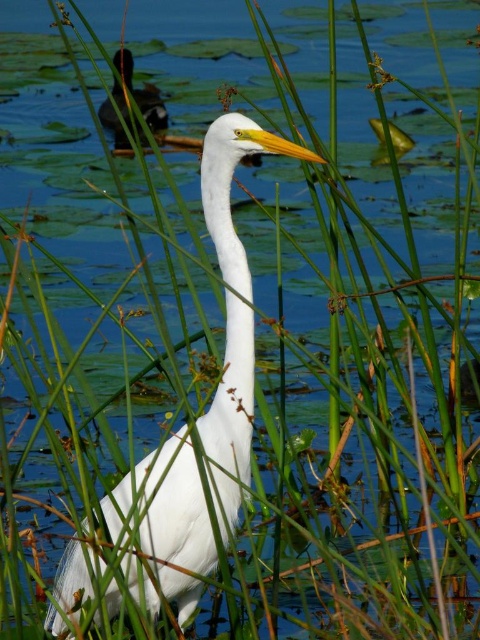
From the picture: Does white matte bird at center have a larger size compared to shiny black duck at upper left?

Correct, white matte bird at center is larger in size than shiny black duck at upper left.

Between point (115, 512) and point (140, 96), which one is positioned in front?

Point (115, 512) is in front.

Locate an element on the screen. white matte bird at center is located at coordinates (229, 186).